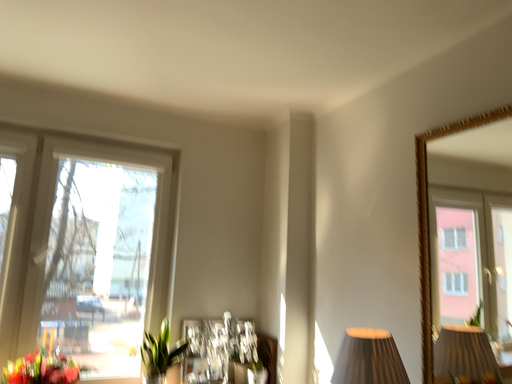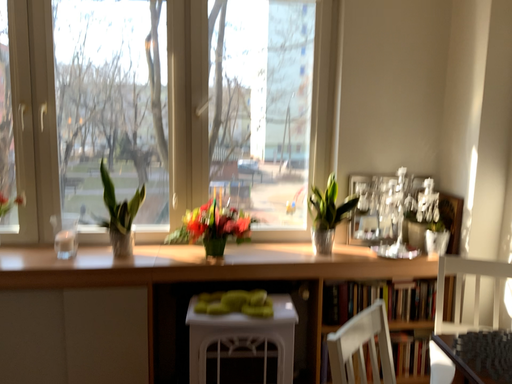
Question: Which way did the camera rotate in the video?

Choices:
 (A) rotated right
 (B) rotated left

Answer: (B)